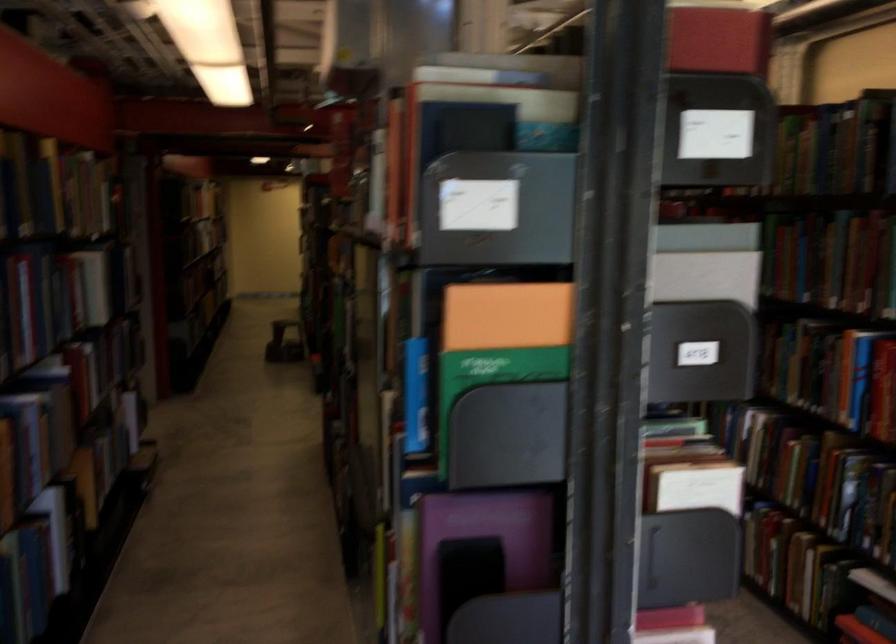
The location [718,40] corresponds to which object?

It refers to a red book.